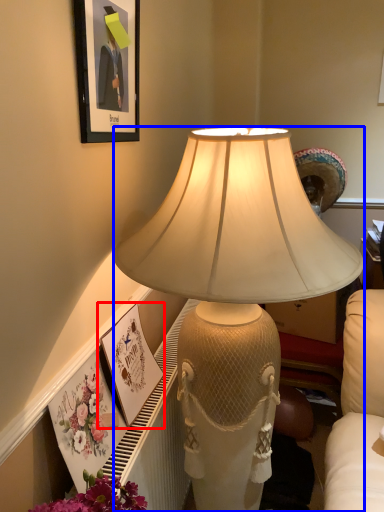
Question: Which object is closer to the camera taking this photo, picture frame (highlighted by a red box) or lamp (highlighted by a blue box)?

Choices:
 (A) picture frame
 (B) lamp

Answer: (B)